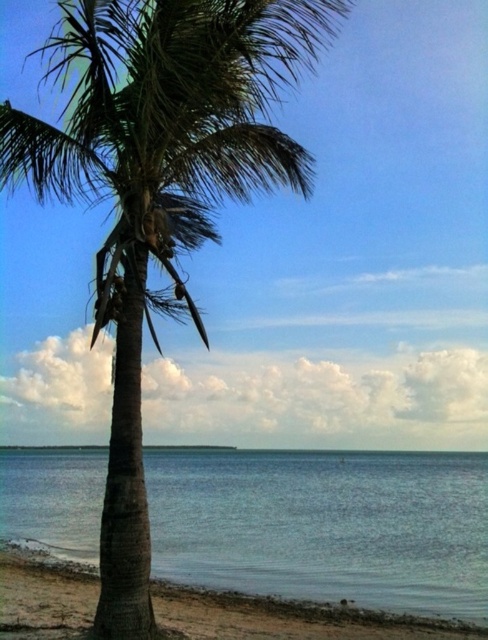
Question: Is blue water at center further to the viewer compared to sandy brown beach at lower left?

Choices:
 (A) yes
 (B) no

Answer: (A)

Question: Estimate the real-world distances between objects in this image. Which object is closer to the green leafy coconut tree at center?

Choices:
 (A) blue water at center
 (B) sandy brown beach at lower left

Answer: (B)

Question: Which is farther from the blue water at center?

Choices:
 (A) sandy brown beach at lower left
 (B) green leafy coconut tree at center

Answer: (B)

Question: Does green leafy coconut tree at center have a larger size compared to sandy brown beach at lower left?

Choices:
 (A) yes
 (B) no

Answer: (A)

Question: Which point is farther from the camera taking this photo?

Choices:
 (A) (24, 584)
 (B) (192, 525)
 (C) (139, 378)

Answer: (B)

Question: Does green leafy coconut tree at center appear over sandy brown beach at lower left?

Choices:
 (A) no
 (B) yes

Answer: (B)